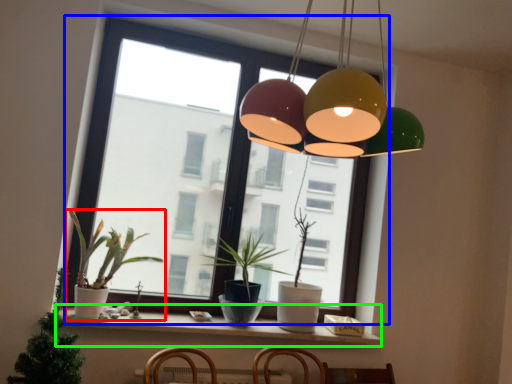
Question: Considering the real-world distances, which object is closest to houseplant (highlighted by a red box)? window (highlighted by a blue box) or window sill (highlighted by a green box).

Choices:
 (A) window
 (B) window sill

Answer: (B)